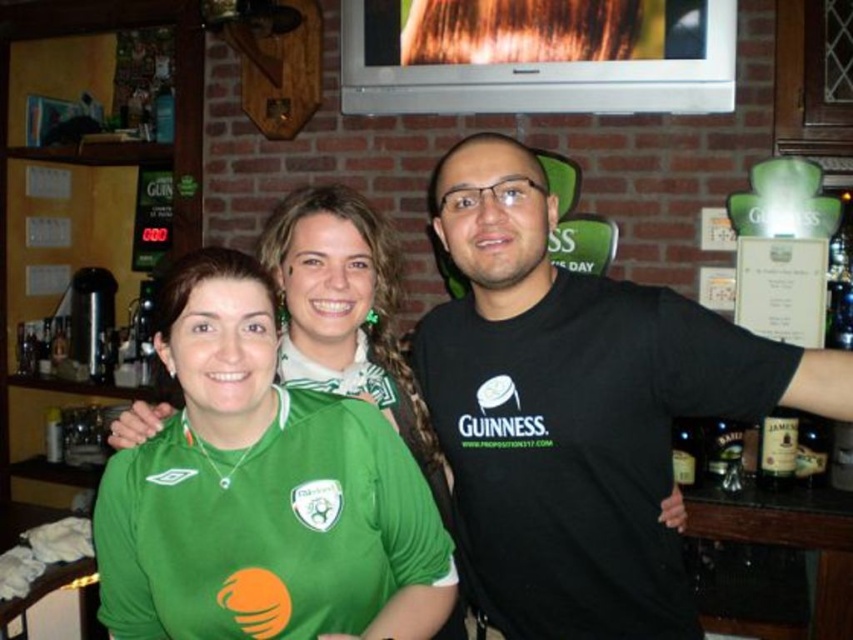
Question: Does black matte t-shirt at center have a smaller size compared to green jersey at center?

Choices:
 (A) no
 (B) yes

Answer: (B)

Question: Which object is positioned closest to the black matte t-shirt at center?

Choices:
 (A) green jersey at center
 (B) brown glass bottle at right

Answer: (A)

Question: Which of the following is the closest to the observer?

Choices:
 (A) (285, 250)
 (B) (531, 212)

Answer: (B)

Question: Which object is closer to the camera taking this photo?

Choices:
 (A) brown glass bottle at right
 (B) black matte t-shirt at center
 (C) green jersey at center

Answer: (B)

Question: Does black matte t-shirt at center appear under brown glass bottle at right?

Choices:
 (A) yes
 (B) no

Answer: (B)

Question: Is the position of green jersey at center less distant than that of brown glass bottle at right?

Choices:
 (A) no
 (B) yes

Answer: (B)